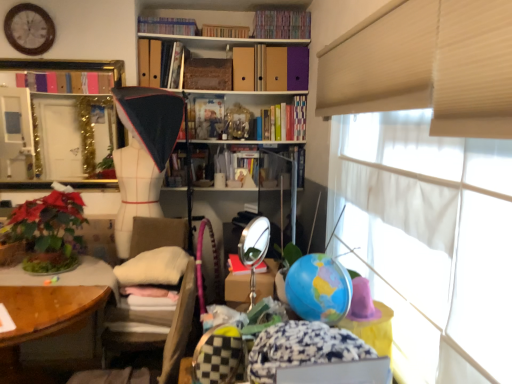
Image resolution: width=512 pixels, height=384 pixels. What do you see at coordinates (170, 64) in the screenshot? I see `matte cardboard book at upper center, positioned as the fourth book in top-to-bottom order` at bounding box center [170, 64].

How much space does hardcover books at upper center, marked as the 1th book in a top-to-bottom arrangement, occupy horizontally?

It is 10.52 inches.

This screenshot has width=512, height=384. Describe the element at coordinates (48, 230) in the screenshot. I see `green leafy plant at lower left` at that location.

Find the location of a particular element. The height and width of the screenshot is (384, 512). wooden clock at upper left is located at coordinates (29, 29).

Is matte plastic book at center, which appears as the second book when ordered from the bottom, shorter than hardcover book at upper center, the third book when ordered from top to bottom?

No, matte plastic book at center, which appears as the second book when ordered from the bottom, is not shorter than hardcover book at upper center, the third book when ordered from top to bottom.

Which object is more forward, matte plastic book at center, which appears as the 5th book when viewed from the top, or hardcover book at upper center, the fourth book ordered from the bottom?

hardcover book at upper center, the fourth book ordered from the bottom, is more forward.

From the image's perspective, between matte plastic book at center, which appears as the second book when ordered from the bottom, and hardcover book at upper center, the fourth book ordered from the bottom, which one is located above?

hardcover book at upper center, the fourth book ordered from the bottom, appears higher in the image.

Can you confirm if matte plastic book at center, which appears as the 5th book when viewed from the top, is thinner than hardcover book at upper center, the fourth book ordered from the bottom?

Yes.

Is hardcover book at upper center, the third book when ordered from top to bottom, looking in the opposite direction of hardcover books at upper center, which is the 6th book in top-to-bottom order?

No, hardcover book at upper center, the third book when ordered from top to bottom, is not facing the opposite direction of hardcover books at upper center, which is the 6th book in top-to-bottom order.

Between hardcover book at upper center, the third book when ordered from top to bottom, and hardcover books at upper center, marked as the 1th book in a bottom-to-top arrangement, which one has larger width?

hardcover books at upper center, marked as the 1th book in a bottom-to-top arrangement.

From the image's perspective, is hardcover book at upper center, the third book when ordered from top to bottom, located above hardcover books at upper center, which is the 6th book in top-to-bottom order?

Yes, from the image's perspective, hardcover book at upper center, the third book when ordered from top to bottom, is above hardcover books at upper center, which is the 6th book in top-to-bottom order.

Is hardcover book at upper center, the fourth book ordered from the bottom, directly adjacent to hardcover books at upper center, marked as the 1th book in a bottom-to-top arrangement?

No.

Does hardcover book at upper center, the fourth book ordered from the bottom, have a greater width compared to hardcover books at upper center, placed as the fifth book when sorted from bottom to top?

Yes.

From a real-world perspective, is hardcover book at upper center, the fourth book ordered from the bottom, positioned over hardcover books at upper center, the second book when ordered from top to bottom, based on gravity?

Incorrect, from a real-world perspective, hardcover book at upper center, the fourth book ordered from the bottom, is lower than hardcover books at upper center, the second book when ordered from top to bottom.

Does hardcover book at upper center, the fourth book ordered from the bottom, touch hardcover books at upper center, the second book when ordered from top to bottom?

There is a gap between hardcover book at upper center, the fourth book ordered from the bottom, and hardcover books at upper center, the second book when ordered from top to bottom.

Is hardcover books at upper center, the second book when ordered from top to bottom, at the back of hardcover book at upper center, the fourth book ordered from the bottom?

No.

From the image's perspective, which object appears higher, beige fabric chair at center or matte cardboard book at upper center, positioned as the fourth book in top-to-bottom order?

From the image's view, matte cardboard book at upper center, positioned as the fourth book in top-to-bottom order, is above.

Considering the relative sizes of beige fabric chair at center and matte cardboard book at upper center, positioned as the 3th book in bottom-to-top order, in the image provided, is beige fabric chair at center taller than matte cardboard book at upper center, positioned as the 3th book in bottom-to-top order,?

Yes.

Which object is further away from the camera, beige fabric chair at center or matte cardboard book at upper center, positioned as the 3th book in bottom-to-top order?

matte cardboard book at upper center, positioned as the 3th book in bottom-to-top order, is further away from the camera.

From a real-world perspective, is beige fabric chair at center located beneath matte cardboard book at upper center, positioned as the fourth book in top-to-bottom order?

Yes, from a real-world perspective, beige fabric chair at center is under matte cardboard book at upper center, positioned as the fourth book in top-to-bottom order.

Considering the relative positions of matte plastic book at center, which appears as the 5th book when viewed from the top, and white fabric mannequin at center in the image provided, is matte plastic book at center, which appears as the 5th book when viewed from the top, behind white fabric mannequin at center?

Yes, it is.

Can you tell me how much matte plastic book at center, which appears as the second book when ordered from the bottom, and white fabric mannequin at center differ in facing direction?

The angular difference between matte plastic book at center, which appears as the second book when ordered from the bottom, and white fabric mannequin at center is 12 degrees.

Consider the image. Could you tell me if matte plastic book at center, which appears as the second book when ordered from the bottom, is facing white fabric mannequin at center?

No, matte plastic book at center, which appears as the second book when ordered from the bottom, does not turn towards white fabric mannequin at center.

Considering the relative positions of matte plastic book at center, which appears as the second book when ordered from the bottom, and white fabric mannequin at center in the image provided, is matte plastic book at center, which appears as the second book when ordered from the bottom, to the left or to the right of white fabric mannequin at center?

Based on their positions, matte plastic book at center, which appears as the second book when ordered from the bottom, is located to the right of white fabric mannequin at center.

From their relative heights in the image, would you say matte plastic book at center, which appears as the 5th book when viewed from the top, is taller or shorter than gold metallic mirror at upper left?

matte plastic book at center, which appears as the 5th book when viewed from the top, is shorter than gold metallic mirror at upper left.

How many degrees apart are the facing directions of matte plastic book at center, which appears as the second book when ordered from the bottom, and gold metallic mirror at upper left?

There is a 5.2-degree angle between the facing directions of matte plastic book at center, which appears as the second book when ordered from the bottom, and gold metallic mirror at upper left.

Considering the sizes of objects matte plastic book at center, which appears as the second book when ordered from the bottom, and gold metallic mirror at upper left in the image provided, who is thinner, matte plastic book at center, which appears as the second book when ordered from the bottom, or gold metallic mirror at upper left?

Thinner between the two is matte plastic book at center, which appears as the second book when ordered from the bottom.

How far apart are matte plastic book at center, which appears as the 5th book when viewed from the top, and gold metallic mirror at upper left?

They are 30.68 inches apart.

Measure the distance between hardcover books at upper center, marked as the 1th book in a top-to-bottom arrangement, and beige fabric chair at center.

6.82 feet.

Considering the relative sizes of hardcover books at upper center, which appears as the sixth book when ordered from the bottom, and beige fabric chair at center in the image provided, is hardcover books at upper center, which appears as the sixth book when ordered from the bottom, wider than beige fabric chair at center?

In fact, hardcover books at upper center, which appears as the sixth book when ordered from the bottom, might be narrower than beige fabric chair at center.

Is point (289, 26) closer or farther from the camera than point (185, 340)?

Point (289, 26) appears to be farther away from the viewer than point (185, 340).

Which is more to the right, hardcover books at upper center, marked as the 1th book in a top-to-bottom arrangement, or beige fabric chair at center?

From the viewer's perspective, hardcover books at upper center, marked as the 1th book in a top-to-bottom arrangement, appears more on the right side.

From the image's perspective, starting from the hardcover book at upper center, the third book when ordered from top to bottom, which book is the 2nd one below? Please provide its 2D coordinates.

[(209, 118)]

Where is `book that is the 3rd object located behind the hardcover book at upper center, the third book when ordered from top to bottom`? book that is the 3rd object located behind the hardcover book at upper center, the third book when ordered from top to bottom is located at coordinates (283, 121).

From the picture: When comparing their distances from hardcover books at upper center, which appears as the sixth book when ordered from the bottom, does wooden at left or matte plastic book at center, which appears as the second book when ordered from the bottom, seem further?

The object further to hardcover books at upper center, which appears as the sixth book when ordered from the bottom, is wooden at left.

Looking at the image, which one is located further to white fabric at upper right, beige fabric chair at center or matte cardboard book at upper center, positioned as the 3th book in bottom-to-top order?

Based on the image, matte cardboard book at upper center, positioned as the 3th book in bottom-to-top order, appears to be further to white fabric at upper right.

Which object lies further to the anchor point hardcover books at upper center, placed as the fifth book when sorted from bottom to top, wooden clock at upper left or gold metallic mirror at upper left?

wooden clock at upper left.

Considering their positions, is matte plastic book at center, which appears as the 5th book when viewed from the top, positioned closer to beige fabric chair at center than hardcover books at upper center, the second book when ordered from top to bottom?

matte plastic book at center, which appears as the 5th book when viewed from the top, is positioned closer to the anchor beige fabric chair at center.

Looking at the image, which one is located further to beige fabric chair at center, wooden clock at upper left or green leafy plant at lower left?

wooden clock at upper left is further to beige fabric chair at center.

Estimate the real-world distances between objects in this image. Which object is closer to white fabric mannequin at center, hardcover books at upper center, which is the 6th book in top-to-bottom order, or gold metallic mirror at upper left?

gold metallic mirror at upper left lies closer to white fabric mannequin at center than the other object.

Which object lies nearer to the anchor point white fabric mannequin at center, wooden at left or matte plastic book at center, which appears as the second book when ordered from the bottom?

Based on the image, matte plastic book at center, which appears as the second book when ordered from the bottom, appears to be nearer to white fabric mannequin at center.

When comparing their distances from matte cardboard book at upper center, positioned as the 3th book in bottom-to-top order, does hardcover book at upper center, the third book when ordered from top to bottom, or white fabric at upper right seem closer?

hardcover book at upper center, the third book when ordered from top to bottom, is closer to matte cardboard book at upper center, positioned as the 3th book in bottom-to-top order.

The width and height of the screenshot is (512, 384). Identify the location of doll between wooden clock at upper left and white fabric at upper right in the horizontal direction. (143, 154).

Find the location of `doll between white fabric at upper right and matte plastic book at center, which appears as the 5th book when viewed from the top, from front to back`. doll between white fabric at upper right and matte plastic book at center, which appears as the 5th book when viewed from the top, from front to back is located at coordinates (143, 154).

At what (x,y) coordinates should I click in order to perform the action: click on clock between hardcover books at upper center, placed as the fifth book when sorted from bottom to top, and white fabric mannequin at center vertically. Please return your answer as a coordinate pair (x, y). The width and height of the screenshot is (512, 384). Looking at the image, I should click on (29, 29).

The height and width of the screenshot is (384, 512). Identify the location of doll between hardcover book at upper center, the fourth book ordered from the bottom, and green leafy plant at lower left from top to bottom. pos(143,154).